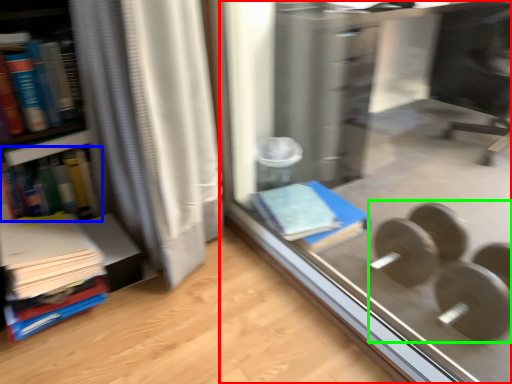
Question: Which object is positioned farthest from glass door (highlighted by a red box)? Select from book (highlighted by a blue box) and dumbbell (highlighted by a green box).

Choices:
 (A) book
 (B) dumbbell

Answer: (A)